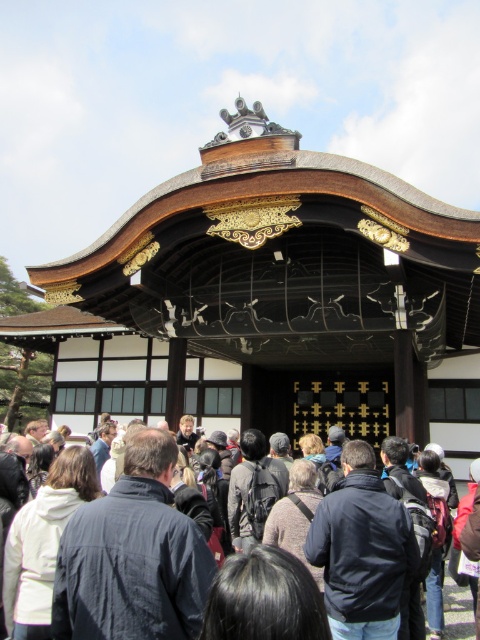
You are standing at the entrance of the temple gate and want to take a photo of the white fleece jacket at lower left and the dark blue fabric backpack at center in the same frame. The camera you have can capture objects within a 30 meter range. Can both objects be captured in the same photo?

The white fleece jacket at lower left is 27.42 meters away from the dark blue fabric backpack at center. Since the maximum distance between them is within the 30 meter range of the camera, both objects can be captured in the same photo.

You are a photographer trying to capture a clear shot of the knitted sweater at center without the black hair at center blocking it. Based on their positions, is this possible?

The black hair at center is positioned over the knitted sweater at center, so it is blocking the view of the knitted sweater at center. Therefore, capturing a clear shot of the knitted sweater at center without the black hair at center would not be possible unless the photographer moves to a different angle or the person adjusts their position.